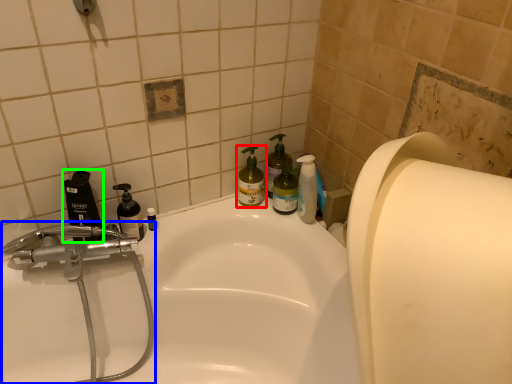
Question: Which object is the farthest from cleaning product (highlighted by a red box)? Choose among these: plumbing fixture (highlighted by a blue box) or mouthwash (highlighted by a green box).

Choices:
 (A) plumbing fixture
 (B) mouthwash

Answer: (A)